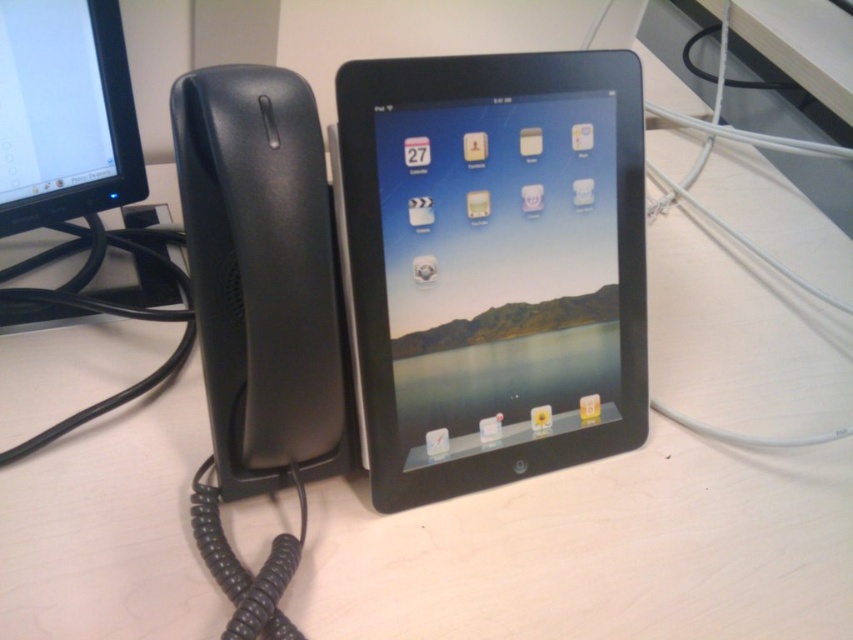
Measure the distance from black glossy tablet at center to matte black monitor at upper left.

black glossy tablet at center is 30.18 centimeters from matte black monitor at upper left.

Does black glossy tablet at center appear on the right side of matte black monitor at upper left?

Yes, black glossy tablet at center is to the right of matte black monitor at upper left.

Which is in front, point (432, 300) or point (1, 141)?

Point (432, 300)

Identify the location of black glossy tablet at center. This screenshot has height=640, width=853. (492, 262).